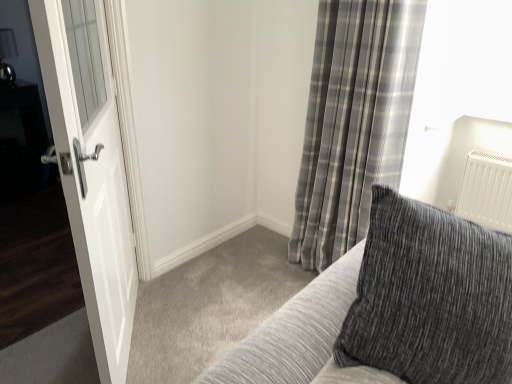
The image size is (512, 384). Find the location of `gray plaid curtain at upper right`. gray plaid curtain at upper right is located at coordinates (353, 121).

Find the location of a particular element. The width and height of the screenshot is (512, 384). textured gray pillow at upper right is located at coordinates pyautogui.click(x=430, y=297).

Is gray plaid curtain at upper right oriented away from white glossy door at left?

gray plaid curtain at upper right is not turned away from white glossy door at left.

Is gray plaid curtain at upper right thinner than white glossy door at left?

In fact, gray plaid curtain at upper right might be wider than white glossy door at left.

Is gray plaid curtain at upper right smaller than white glossy door at left?

Incorrect, gray plaid curtain at upper right is not smaller in size than white glossy door at left.

Considering the sizes of objects gray plaid curtain at upper right and white glossy door at left in the image provided, who is taller, gray plaid curtain at upper right or white glossy door at left?

With more height is gray plaid curtain at upper right.

Is point (397, 365) positioned behind point (93, 235)?

No, it is in front of (93, 235).

Looking at this image, considering the sizes of objects textured gray pillow at upper right and white glossy door at left in the image provided, who is bigger, textured gray pillow at upper right or white glossy door at left?

With larger size is textured gray pillow at upper right.

You are a GUI agent. You are given a task and a screenshot of the screen. Output one action in this format:
    pyautogui.click(x=<x>, y=<y>)
    Task: Click on the door behind the textured gray pillow at upper right
    This screenshot has width=512, height=384.
    Given the screenshot: What is the action you would take?
    pyautogui.click(x=92, y=187)

Is white glossy door at left positioned in front of gray plaid curtain at upper right?

Yes, it is in front of gray plaid curtain at upper right.

From the picture: Can you confirm if white glossy door at left is taller than gray plaid curtain at upper right?

In fact, white glossy door at left may be shorter than gray plaid curtain at upper right.

Consider the image. Which point is more forward, (108, 69) or (326, 196)?

The point (108, 69) is closer to the camera.

Considering the sizes of objects white glossy door at left and gray plaid curtain at upper right in the image provided, who is wider, white glossy door at left or gray plaid curtain at upper right?

Wider between the two is gray plaid curtain at upper right.

Considering the relative sizes of textured gray pillow at upper right and gray plaid curtain at upper right in the image provided, is textured gray pillow at upper right thinner than gray plaid curtain at upper right?

In fact, textured gray pillow at upper right might be wider than gray plaid curtain at upper right.

From the image's perspective, would you say textured gray pillow at upper right is shown under gray plaid curtain at upper right?

Correct, textured gray pillow at upper right appears lower than gray plaid curtain at upper right in the image.

Does textured gray pillow at upper right have a larger size compared to gray plaid curtain at upper right?

No, textured gray pillow at upper right is not bigger than gray plaid curtain at upper right.

Is textured gray pillow at upper right in contact with gray plaid curtain at upper right?

There is a gap between textured gray pillow at upper right and gray plaid curtain at upper right.

Is point (315, 69) closer to camera compared to point (394, 231)?

No, (315, 69) is further to viewer.

Is gray plaid curtain at upper right surrounding textured gray pillow at upper right?

Actually, textured gray pillow at upper right is outside gray plaid curtain at upper right.

Between gray plaid curtain at upper right and textured gray pillow at upper right, which one has more height?

Standing taller between the two is gray plaid curtain at upper right.

Relative to textured gray pillow at upper right, is gray plaid curtain at upper right in front or behind?

Visually, gray plaid curtain at upper right is located behind textured gray pillow at upper right.

Is white glossy door at left in front of textured gray pillow at upper right?

No, white glossy door at left is further to the viewer.

Is white glossy door at left thinner than textured gray pillow at upper right?

Indeed, white glossy door at left has a lesser width compared to textured gray pillow at upper right.

At what (x,y) coordinates should I click in order to perform the action: click on door located underneath the textured gray pillow at upper right (from a real-world perspective). Please return your answer as a coordinate pair (x, y). Looking at the image, I should click on (92, 187).

Looking at this image, considering the relative sizes of white glossy door at left and textured gray pillow at upper right in the image provided, is white glossy door at left shorter than textured gray pillow at upper right?

No, white glossy door at left is not shorter than textured gray pillow at upper right.

Locate an element on the screen. The image size is (512, 384). door below the gray plaid curtain at upper right (from the image's perspective) is located at coordinates (92, 187).

Locate an element on the screen. pillow located above the white glossy door at left (from a real-world perspective) is located at coordinates (430, 297).

When comparing their distances from gray plaid curtain at upper right, does textured gray pillow at upper right or white glossy door at left seem further?

textured gray pillow at upper right is further to gray plaid curtain at upper right.

Looking at this image, from the image, which object appears to be farther from textured gray pillow at upper right, gray plaid curtain at upper right or white glossy door at left?

gray plaid curtain at upper right lies further to textured gray pillow at upper right than the other object.

Considering their positions, is textured gray pillow at upper right positioned closer to white glossy door at left than gray plaid curtain at upper right?

Among the two, textured gray pillow at upper right is located nearer to white glossy door at left.

Estimate the real-world distances between objects in this image. Which object is closer to textured gray pillow at upper right, white glossy door at left or gray plaid curtain at upper right?

Among the two, white glossy door at left is located nearer to textured gray pillow at upper right.

Considering their positions, is white glossy door at left positioned closer to gray plaid curtain at upper right than textured gray pillow at upper right?

white glossy door at left is closer to gray plaid curtain at upper right.

Estimate the real-world distances between objects in this image. Which object is further from white glossy door at left, gray plaid curtain at upper right or textured gray pillow at upper right?

gray plaid curtain at upper right is further to white glossy door at left.

At what (x,y) coordinates should I click in order to perform the action: click on pillow located between white glossy door at left and gray plaid curtain at upper right in the left-right direction. Please return your answer as a coordinate pair (x, y). Looking at the image, I should click on (430, 297).